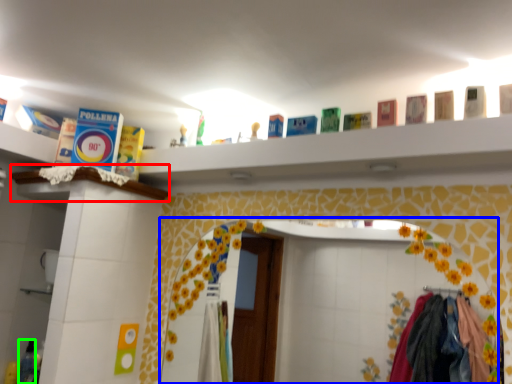
Question: Based on their relative distances, which object is farther from ledge (highlighted by a red box)? Choose from mirror (highlighted by a blue box) and toiletry (highlighted by a green box).

Choices:
 (A) mirror
 (B) toiletry

Answer: (A)